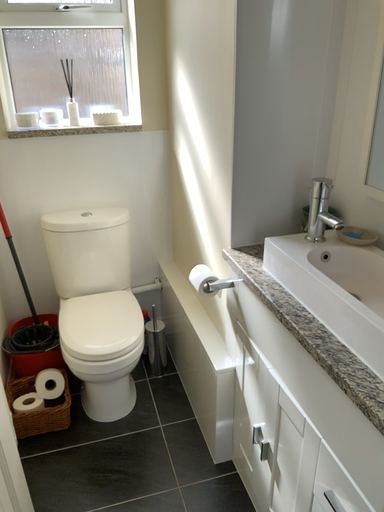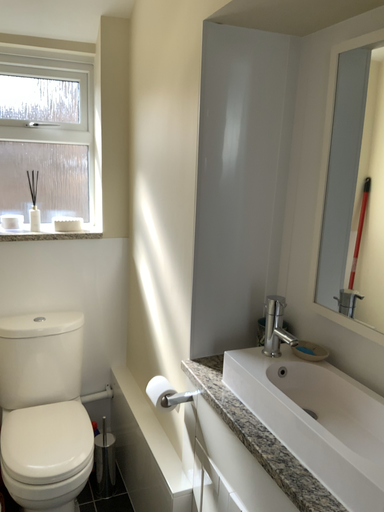
Question: How did the camera likely rotate when shooting the video?

Choices:
 (A) rotated downward
 (B) rotated upward

Answer: (B)